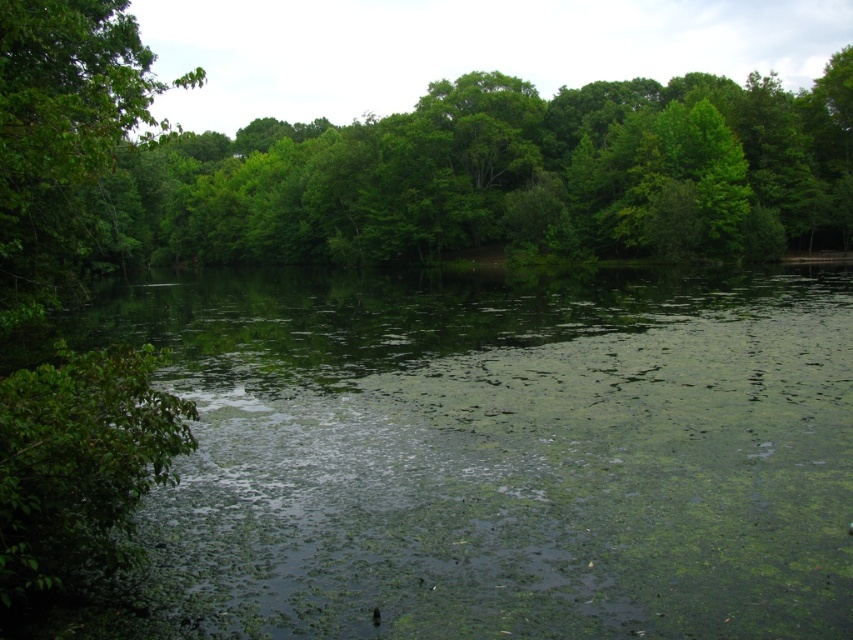
Who is positioned more to the left, green algae-covered water at center or green leafy tree at left?

Positioned to the left is green leafy tree at left.

I want to click on green algae-covered water at center, so click(497, 454).

In order to click on green algae-covered water at center in this screenshot , I will do (497, 454).

Is point (636, 506) positioned before point (364, 205)?

Yes, point (636, 506) is closer to viewer.

Describe the element at coordinates (497, 454) in the screenshot. I see `green algae-covered water at center` at that location.

Measure the distance between green algae-covered water at center and camera.

green algae-covered water at center is 16.48 feet from camera.

What are the coordinates of `green algae-covered water at center` in the screenshot? It's located at (497, 454).

This screenshot has width=853, height=640. In order to click on green leafy forest at center in this screenshot , I will do `click(398, 164)`.

Is green leafy forest at center smaller than green leafy tree at left?

Incorrect, green leafy forest at center is not smaller in size than green leafy tree at left.

Does point (219, 193) come in front of point (112, 204)?

That is False.

Find the location of `green leafy forest at center`. green leafy forest at center is located at coordinates (398, 164).